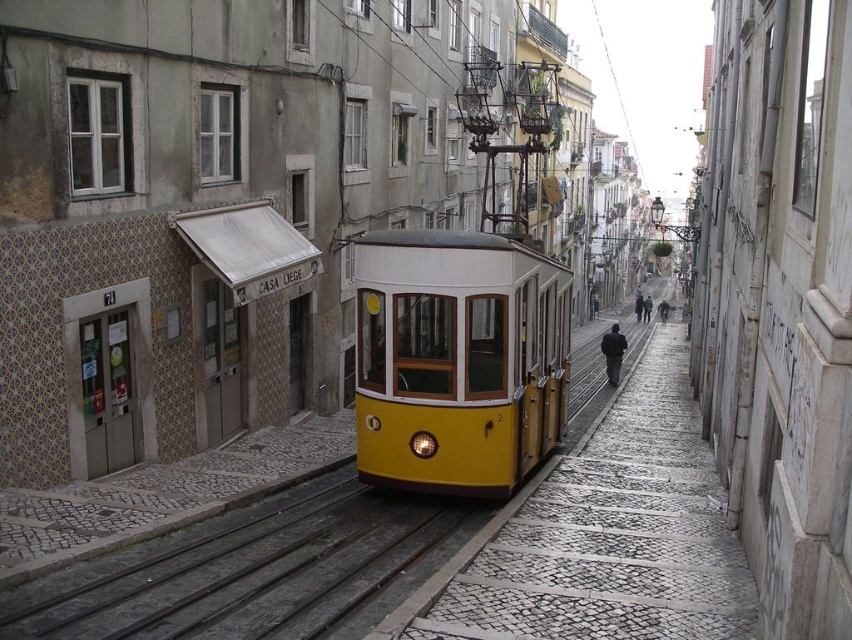
Question: Which of the following is the closest to the observer?

Choices:
 (A) (447, 330)
 (B) (309, 616)

Answer: (B)

Question: Which point is closer to the camera taking this photo?

Choices:
 (A) (471, 330)
 (B) (216, 637)

Answer: (B)

Question: Is yellow matte cable car at center to the left of metallic gray train track at center from the viewer's perspective?

Choices:
 (A) no
 (B) yes

Answer: (A)

Question: Which object appears farthest from the camera in this image?

Choices:
 (A) metallic gray train track at center
 (B) yellow matte cable car at center

Answer: (B)

Question: Considering the relative positions of yellow matte cable car at center and metallic gray train track at center in the image provided, where is yellow matte cable car at center located with respect to metallic gray train track at center?

Choices:
 (A) right
 (B) left

Answer: (A)

Question: Does yellow matte cable car at center appear on the right side of metallic gray train track at center?

Choices:
 (A) yes
 (B) no

Answer: (A)